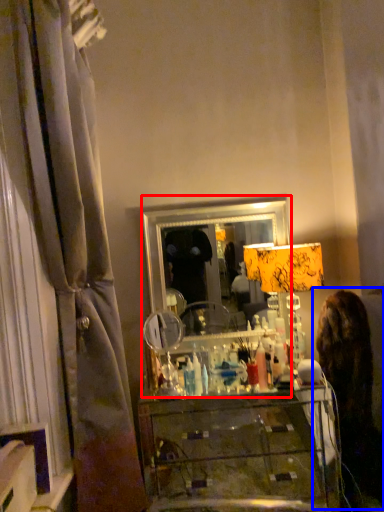
Question: Which point is further to the camera, mirror (highlighted by a red box) or woman (highlighted by a blue box)?

Choices:
 (A) mirror
 (B) woman

Answer: (A)